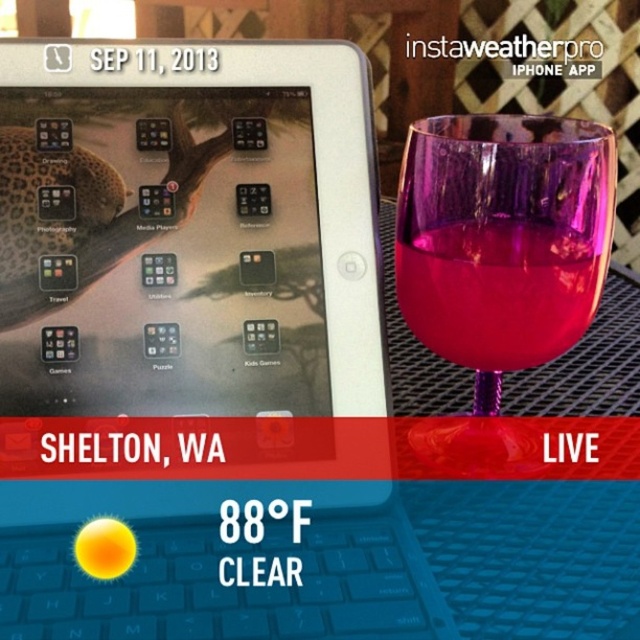
Question: From the image, what is the correct spatial relationship of transparent purple wine glass at right in relation to transparent glass at right?

Choices:
 (A) left
 (B) right

Answer: (B)

Question: Which object appears farthest from the camera in this image?

Choices:
 (A) satin silver laptop at center
 (B) transparent purple wine glass at right
 (C) transparent glass at right

Answer: (C)

Question: Does satin silver laptop at center lie in front of transparent purple wine glass at right?

Choices:
 (A) yes
 (B) no

Answer: (A)

Question: Which point is closer to the camera?

Choices:
 (A) (346, 136)
 (B) (572, 211)

Answer: (B)

Question: Which is farther from the transparent purple wine glass at right?

Choices:
 (A) satin silver laptop at center
 (B) transparent glass at right

Answer: (A)

Question: Does satin silver laptop at center appear over transparent purple wine glass at right?

Choices:
 (A) no
 (B) yes

Answer: (A)